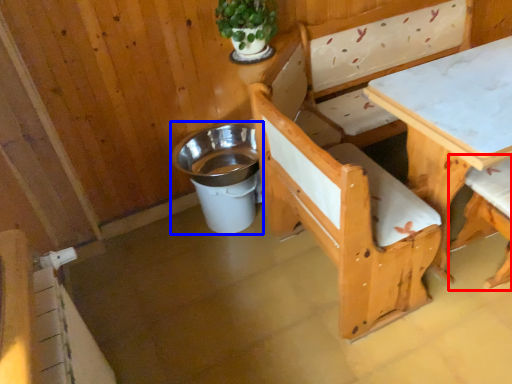
Question: Which of the following is the closest to the observer, chair (highlighted by a red box) or trash bin/can (highlighted by a blue box)?

Choices:
 (A) chair
 (B) trash bin/can

Answer: (A)